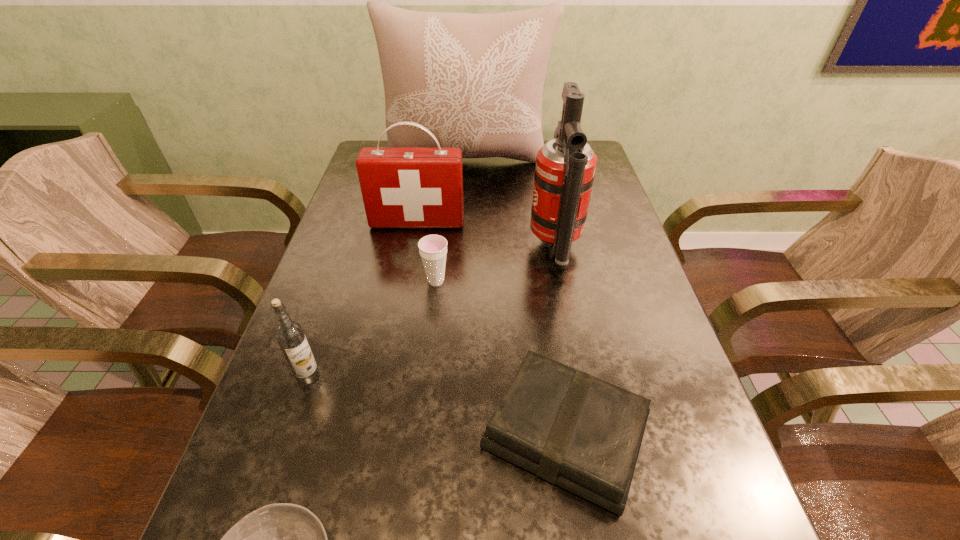
This screenshot has height=540, width=960. What are the coordinates of `book situated at the right edge` in the screenshot? It's located at (566, 426).

Image resolution: width=960 pixels, height=540 pixels. In order to click on object located at the far left corner in this screenshot , I will do `click(475, 81)`.

Locate an element on the screen. The height and width of the screenshot is (540, 960). free point at the far edge is located at coordinates (503, 175).

What are the coordinates of `free space at the left edge of the desktop` in the screenshot? It's located at (354, 343).

I want to click on vacant space at the right edge of the desktop, so click(x=597, y=176).

Locate an element on the screen. This screenshot has height=540, width=960. vacant space that's between the fifth shortest object and the book is located at coordinates (492, 328).

The height and width of the screenshot is (540, 960). I want to click on free space between the cup and the vodka, so click(x=372, y=328).

I want to click on free space between the second tallest object and the first-aid kit, so click(486, 235).

At what (x,y) coordinates should I click in order to perform the action: click on vacant area between the vodka and the farthest object. Please return your answer as a coordinate pair (x, y). Looking at the image, I should click on (388, 268).

This screenshot has height=540, width=960. Identify the location of free space between the book and the farthest object. (516, 297).